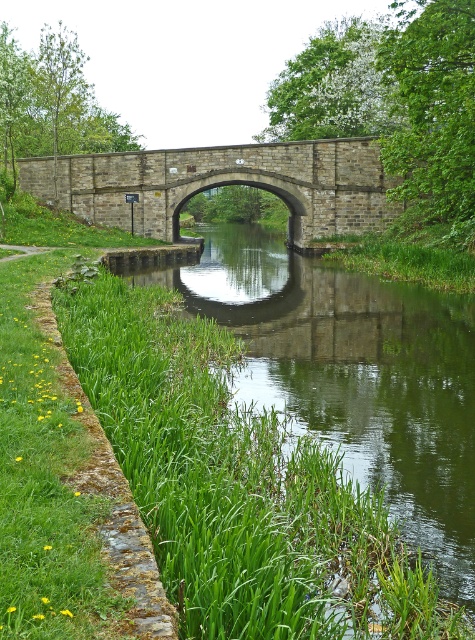
Question: Does green grassy stream at lower left appear on the right side of brown stone bridge at center?

Choices:
 (A) yes
 (B) no

Answer: (A)

Question: Which point appears closest to the camera in this image?

Choices:
 (A) (161, 193)
 (B) (468, 579)

Answer: (B)

Question: Which object is farther from the camera taking this photo?

Choices:
 (A) brown stone bridge at center
 (B) green grassy stream at lower left

Answer: (A)

Question: Does green grassy stream at lower left have a smaller size compared to brown stone bridge at center?

Choices:
 (A) yes
 (B) no

Answer: (B)

Question: Which of the following is the farthest from the observer?

Choices:
 (A) green grassy stream at lower left
 (B) brown stone bridge at center

Answer: (B)

Question: In this image, where is green grassy stream at lower left located relative to brown stone bridge at center?

Choices:
 (A) left
 (B) right

Answer: (B)